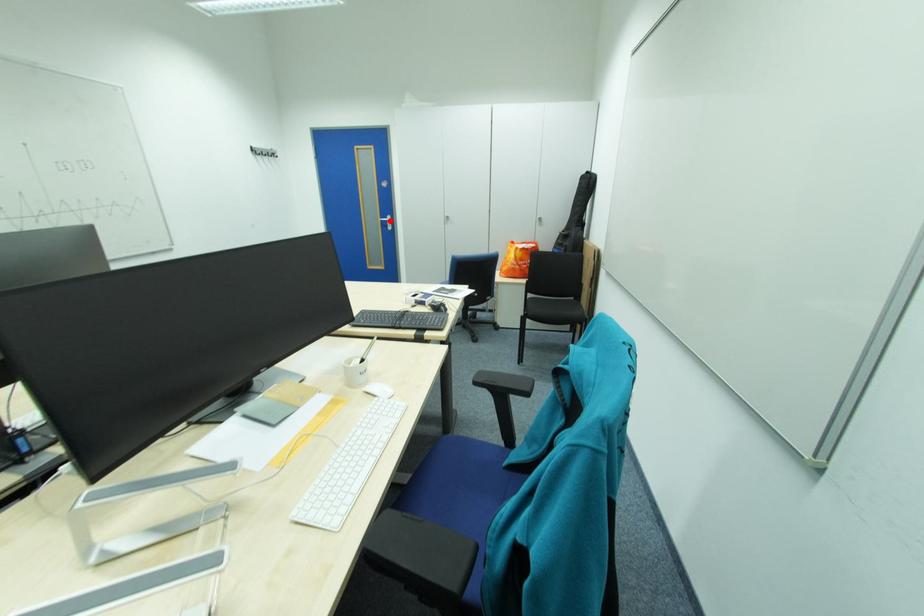
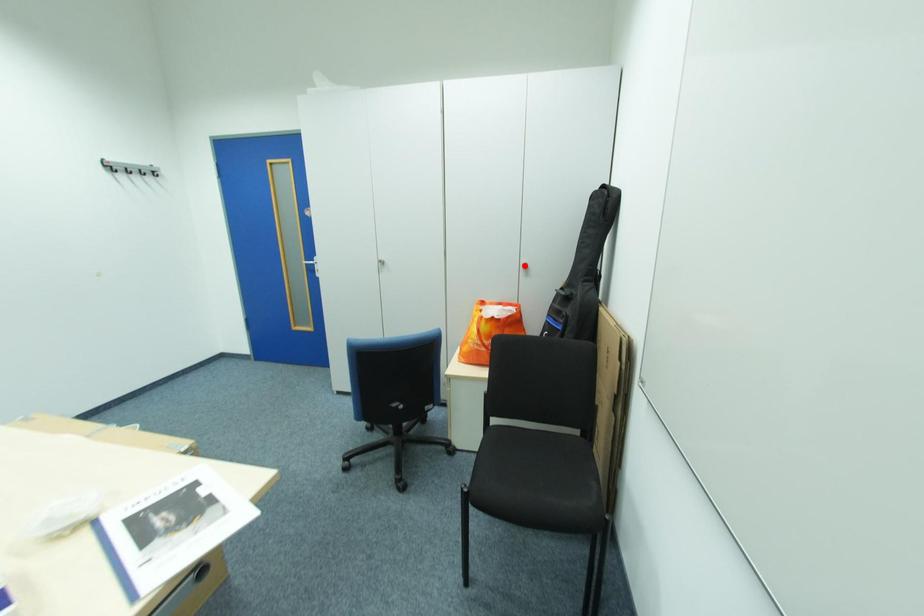
I am providing you with two images of the same scene from different viewpoints. A red point is marked on the first image and another point is marked on the second image. Do the highlighted points in image1 and image2 indicate the same real-world spot?

No